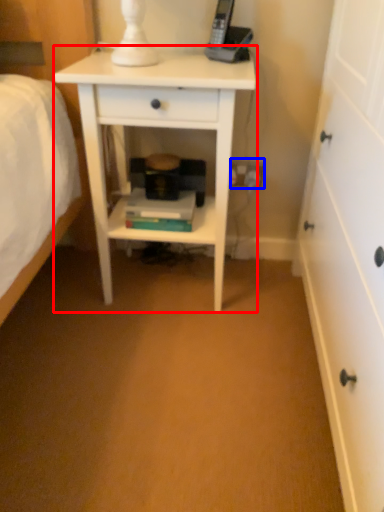
Question: Which of the following is the farthest to the observer, nightstand (highlighted by a red box) or electric outlet (highlighted by a blue box)?

Choices:
 (A) nightstand
 (B) electric outlet

Answer: (B)